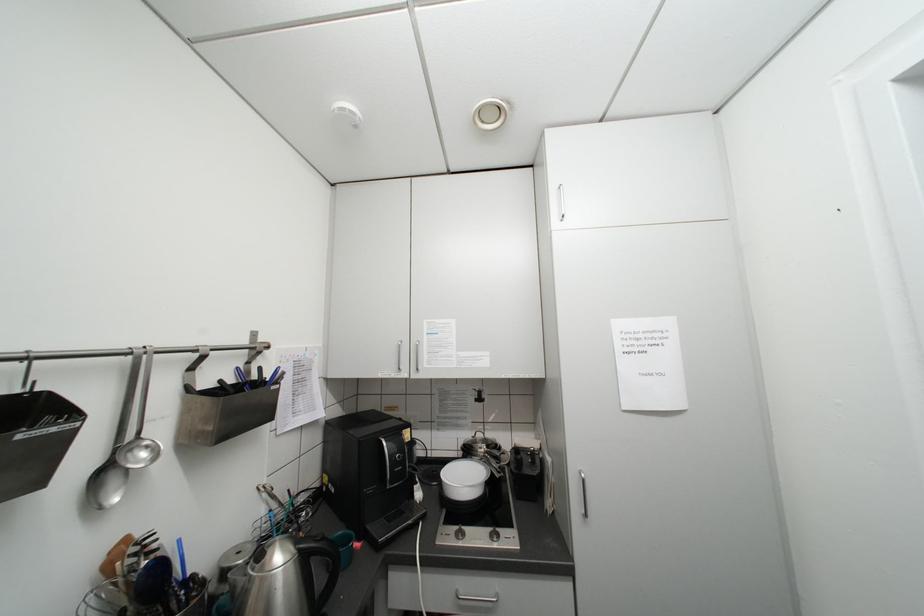
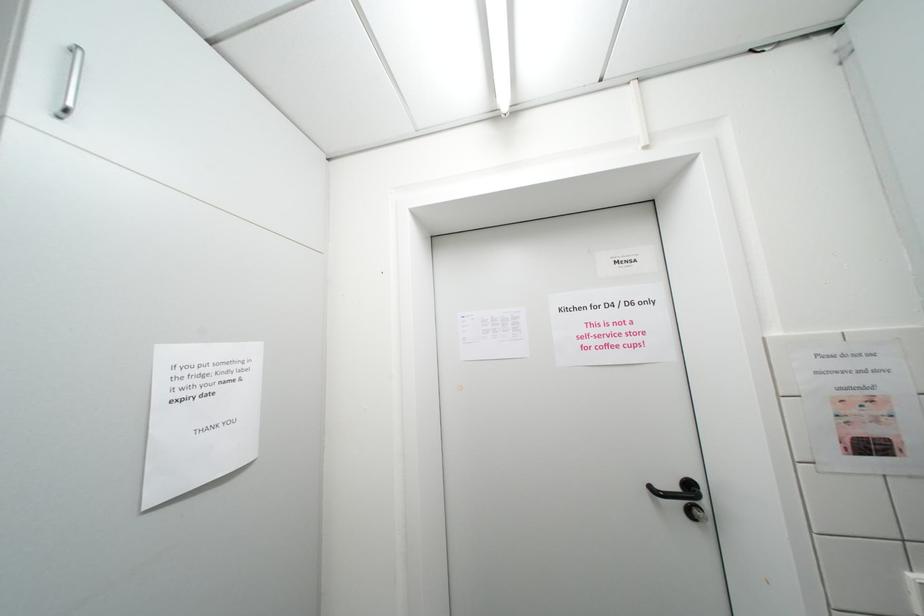
Question: The camera is either moving clockwise (left) or counter-clockwise (right) around the object. The first image is from the beginning of the video and the second image is from the end. Is the camera moving left or right when shooting the video?

Choices:
 (A) Left
 (B) Right

Answer: (A)